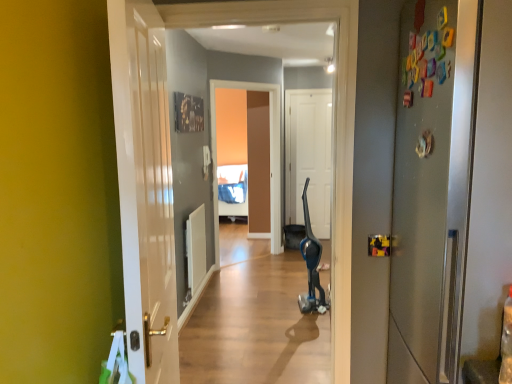
Question: Can you confirm if blue metallic vacuum cleaner at center is thinner than satin silver refrigerator at right, which is counted as the 3th door, starting from the back?

Choices:
 (A) no
 (B) yes

Answer: (A)

Question: From a real-world perspective, is blue metallic vacuum cleaner at center located beneath satin silver refrigerator at right, which ranks as the first door in front-to-back order?

Choices:
 (A) yes
 (B) no

Answer: (A)

Question: Is blue metallic vacuum cleaner at center looking in the opposite direction of satin silver refrigerator at right, which ranks as the first door in front-to-back order?

Choices:
 (A) no
 (B) yes

Answer: (A)

Question: Is blue metallic vacuum cleaner at center bigger than satin silver refrigerator at right, which ranks as the first door in right-to-left order?

Choices:
 (A) yes
 (B) no

Answer: (A)

Question: From the image's perspective, is blue metallic vacuum cleaner at center on satin silver refrigerator at right, which ranks as the first door in front-to-back order?

Choices:
 (A) yes
 (B) no

Answer: (B)

Question: Considering the relative sizes of blue metallic vacuum cleaner at center and satin silver refrigerator at right, positioned as the third door in left-to-right order, in the image provided, is blue metallic vacuum cleaner at center taller than satin silver refrigerator at right, positioned as the third door in left-to-right order,?

Choices:
 (A) no
 (B) yes

Answer: (A)

Question: From the image's perspective, is matte brown screen door at center located beneath black plastic vacuum cleaner at center?

Choices:
 (A) yes
 (B) no

Answer: (B)

Question: From a real-world perspective, is matte brown screen door at center positioned under black plastic vacuum cleaner at center based on gravity?

Choices:
 (A) no
 (B) yes

Answer: (A)

Question: Considering the relative sizes of matte brown screen door at center and black plastic vacuum cleaner at center in the image provided, is matte brown screen door at center bigger than black plastic vacuum cleaner at center?

Choices:
 (A) yes
 (B) no

Answer: (A)

Question: Is matte brown screen door at center thinner than black plastic vacuum cleaner at center?

Choices:
 (A) no
 (B) yes

Answer: (B)

Question: Is matte brown screen door at center further to camera compared to black plastic vacuum cleaner at center?

Choices:
 (A) yes
 (B) no

Answer: (A)

Question: Is black plastic vacuum cleaner at center at the back of matte brown screen door at center?

Choices:
 (A) no
 (B) yes

Answer: (A)

Question: Is satin silver refrigerator at right, positioned as the third door in left-to-right order, aimed at white matte door at center, positioned as the 2th door in right-to-left order?

Choices:
 (A) yes
 (B) no

Answer: (B)